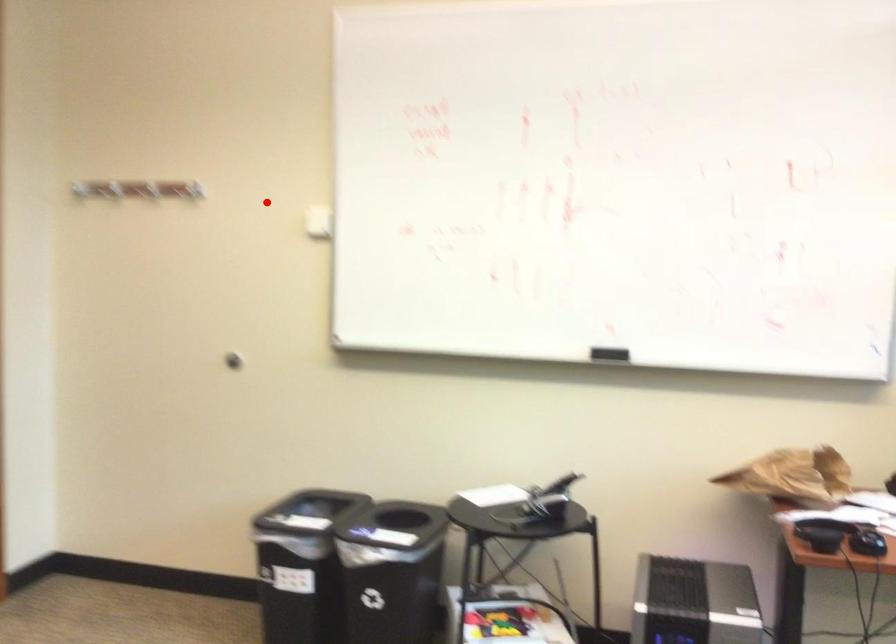
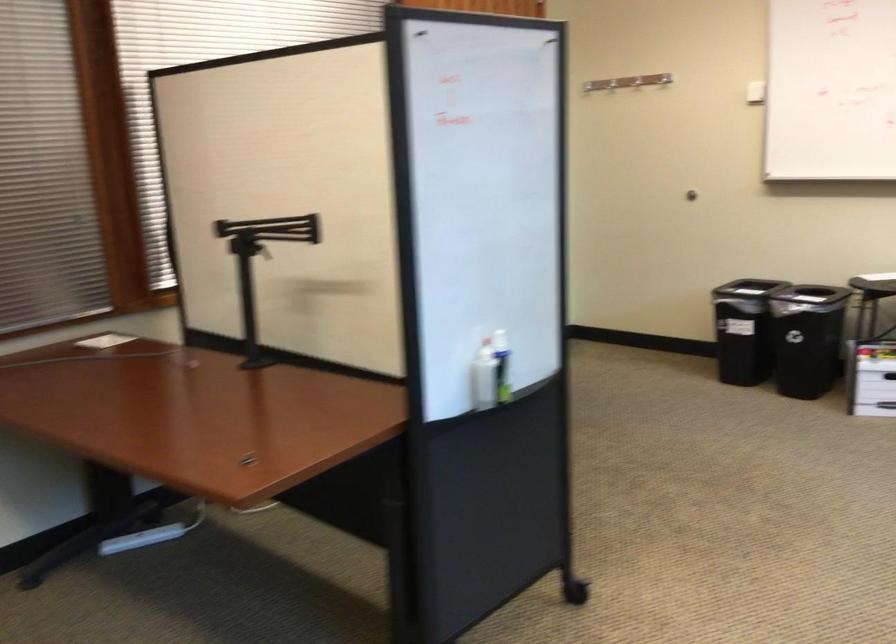
Question: I am providing you with two images of the same scene from different viewpoints. A red point is shown in image1. For the corresponding object point in image2, is it positioned nearer or farther from the camera?

Choices:
 (A) Nearer
 (B) Farther

Answer: (B)